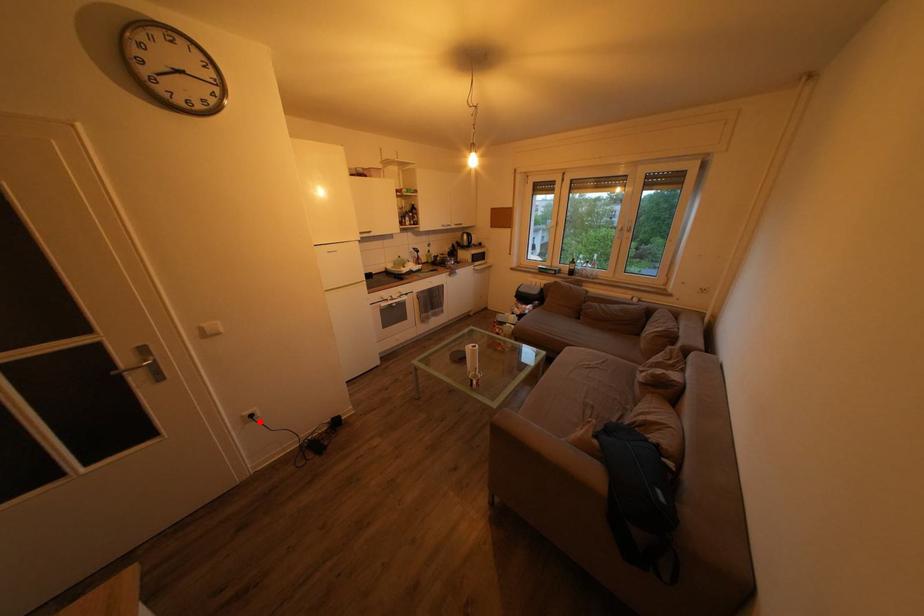
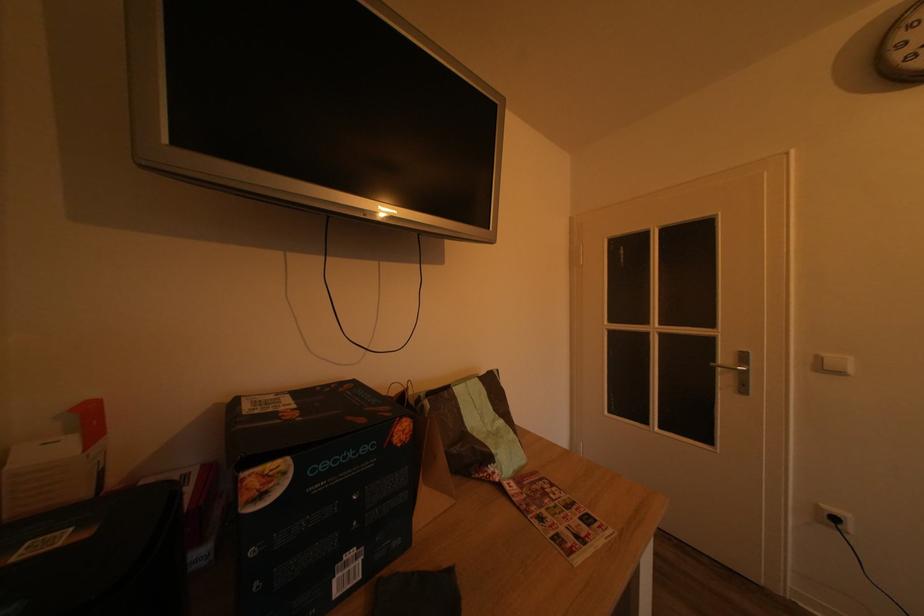
Question: A red point is marked in image1. In image2, is the corresponding 3D point closer to the camera or farther? Reply with the corresponding letter.

Choices:
 (A) The corresponding 3D point is closer.
 (B) The corresponding 3D point is farther.

Answer: (A)